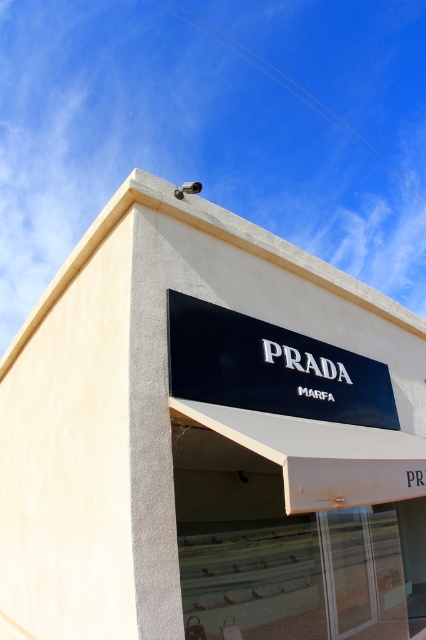
Question: Does black matte sign at center have a lesser width compared to black glossy sign at center?

Choices:
 (A) yes
 (B) no

Answer: (A)

Question: In this image, where is black matte sign at center located relative to black glossy sign at center?

Choices:
 (A) above
 (B) below

Answer: (B)

Question: Which object is farther from the camera taking this photo?

Choices:
 (A) black glossy sign at center
 (B) black matte sign at center

Answer: (B)

Question: Does black matte sign at center appear on the right side of black glossy sign at center?

Choices:
 (A) no
 (B) yes

Answer: (B)